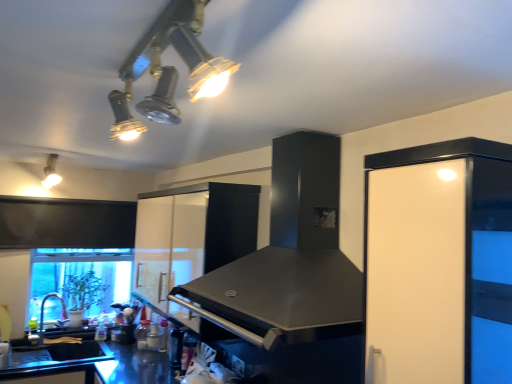
Question: Does black matte sink at lower left appear on the left side of brushed metal faucet at lower left?

Choices:
 (A) no
 (B) yes

Answer: (A)

Question: From a real-world perspective, is black matte sink at lower left below brushed metal faucet at lower left?

Choices:
 (A) yes
 (B) no

Answer: (A)

Question: Is black matte sink at lower left facing away from brushed metal faucet at lower left?

Choices:
 (A) yes
 (B) no

Answer: (B)

Question: Considering the relative positions of black matte sink at lower left and brushed metal faucet at lower left in the image provided, is black matte sink at lower left to the right of brushed metal faucet at lower left from the viewer's perspective?

Choices:
 (A) no
 (B) yes

Answer: (B)

Question: From the image's perspective, is black matte sink at lower left under brushed metal faucet at lower left?

Choices:
 (A) no
 (B) yes

Answer: (B)

Question: Can you confirm if black matte sink at lower left is thinner than brushed metal faucet at lower left?

Choices:
 (A) no
 (B) yes

Answer: (A)

Question: Is matte white light fixture at upper left, arranged as the 1th light fixture when viewed from the left, looking in the opposite direction of metallic track lights at upper center, which is counted as the second light fixture, starting from the back?

Choices:
 (A) no
 (B) yes

Answer: (A)

Question: From the image's perspective, is matte white light fixture at upper left, the second light fixture when ordered from right to left, under metallic track lights at upper center, which appears as the 1th light fixture when viewed from the right?

Choices:
 (A) no
 (B) yes

Answer: (B)

Question: Can you confirm if matte white light fixture at upper left, which appears as the 1th light fixture when viewed from the back, is positioned to the right of metallic track lights at upper center, the second light fixture from the left?

Choices:
 (A) no
 (B) yes

Answer: (A)

Question: From a real-world perspective, does matte white light fixture at upper left, arranged as the 1th light fixture when viewed from the left, sit lower than metallic track lights at upper center, the second light fixture from the left?

Choices:
 (A) yes
 (B) no

Answer: (B)

Question: Is metallic track lights at upper center, which is counted as the second light fixture, starting from the back, inside matte white light fixture at upper left, which appears as the 1th light fixture when viewed from the back?

Choices:
 (A) no
 (B) yes

Answer: (A)

Question: Does matte white light fixture at upper left, which appears as the 1th light fixture when viewed from the back, have a greater width compared to metallic track lights at upper center, the 1th light fixture when ordered from front to back?

Choices:
 (A) no
 (B) yes

Answer: (A)

Question: Is white glossy cabinet at center, the 1th cabinetry from the back, next to matte white light fixture at upper left, the second light fixture when ordered from right to left, and touching it?

Choices:
 (A) no
 (B) yes

Answer: (A)